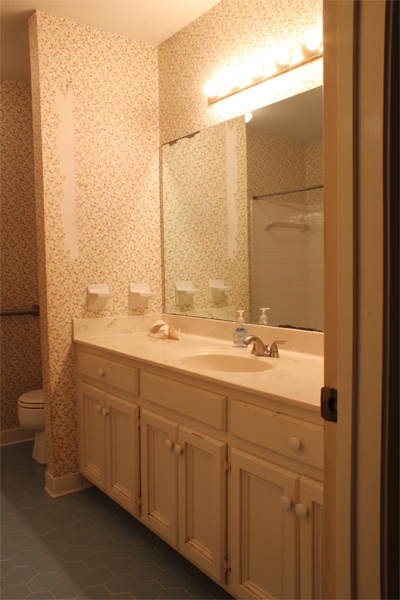
You are a GUI agent. You are given a task and a screenshot of the screen. Output one action in this format:
    pyautogui.click(x=<x>, y=<y>)
    Task: Click on the toilet
    Image resolution: width=400 pixels, height=600 pixels.
    Given the screenshot: What is the action you would take?
    pyautogui.click(x=37, y=414)